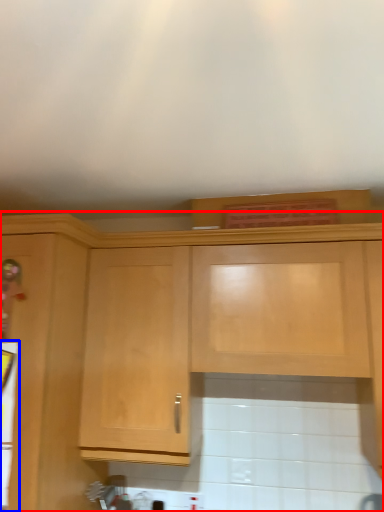
Question: Which point is further to the camera, cabinetry (highlighted by a red box) or appliance (highlighted by a blue box)?

Choices:
 (A) cabinetry
 (B) appliance

Answer: (B)